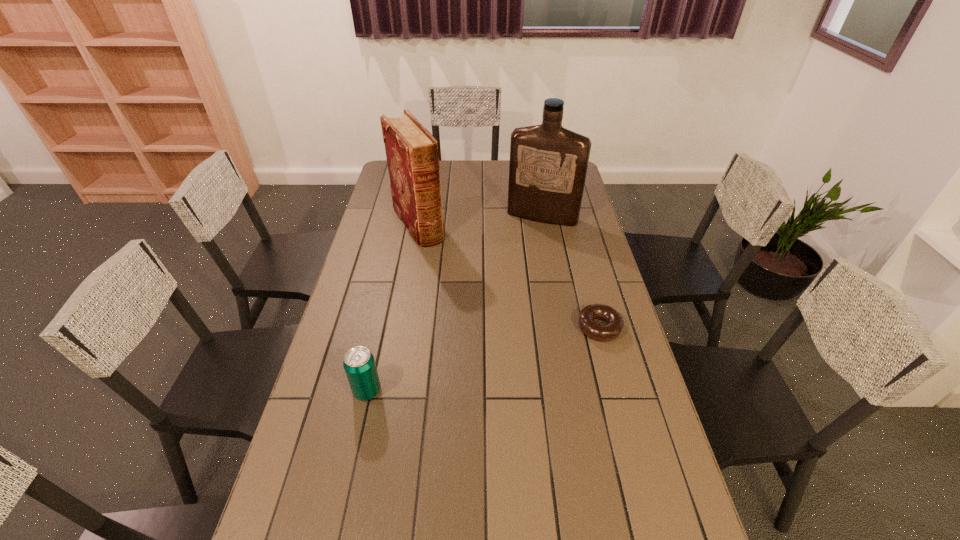
Image resolution: width=960 pixels, height=540 pixels. What are the coordinates of `vacant space at the left edge` in the screenshot? It's located at (303, 430).

In the image, there is a desktop. Identify the location of vacant space at the right edge. (621, 388).

The height and width of the screenshot is (540, 960). In order to click on vacant point located between the hardback book and the doughnut in this screenshot , I will do point(509,275).

You are a GUI agent. You are given a task and a screenshot of the screen. Output one action in this format:
    pyautogui.click(x=<x>, y=<y>)
    Task: Click on the vacant space that is in between the liquor and the hardback book
    Image resolution: width=960 pixels, height=540 pixels.
    Given the screenshot: What is the action you would take?
    pyautogui.click(x=480, y=220)

Image resolution: width=960 pixels, height=540 pixels. Identify the location of vacant region between the nearest object and the second tallest object. (393, 307).

At what (x,y) coordinates should I click in order to perform the action: click on free spot between the third shortest object and the shortest object. Please return your answer as a coordinate pair (x, y). Image resolution: width=960 pixels, height=540 pixels. Looking at the image, I should click on (509, 275).

The width and height of the screenshot is (960, 540). What are the coordinates of `free spot between the nearest object and the hardback book` in the screenshot? It's located at pos(393,307).

The width and height of the screenshot is (960, 540). Find the location of `free spot between the second tallest object and the third farthest object`. free spot between the second tallest object and the third farthest object is located at coordinates (509, 275).

At what (x,y) coordinates should I click in order to perform the action: click on vacant space that is in between the second tallest object and the shortest object. Please return your answer as a coordinate pair (x, y). The image size is (960, 540). Looking at the image, I should click on (509, 275).

Image resolution: width=960 pixels, height=540 pixels. Identify the location of empty location between the shortest object and the liquor. (571, 272).